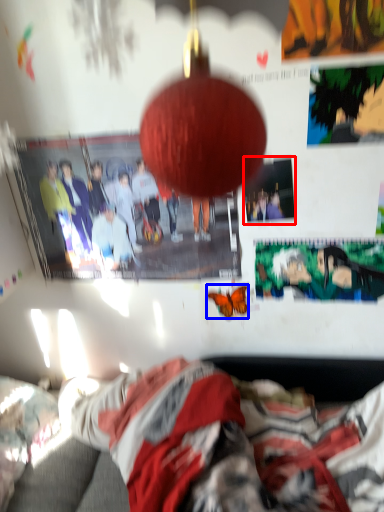
Question: Which of the following is the farthest to the observer, poster page (highlighted by a red box) or butterfly (highlighted by a blue box)?

Choices:
 (A) poster page
 (B) butterfly

Answer: (B)